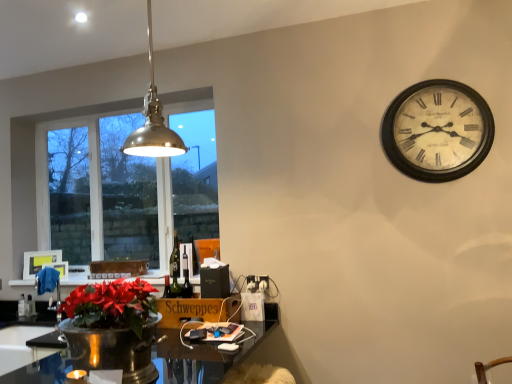
Question: In which direction should I rotate to look at brown cardboard box at lower center, the first cardboard box viewed from the left?

Choices:
 (A) right
 (B) left

Answer: (B)

Question: Is clear glass window at left thinner than metallic pendant light at upper left?

Choices:
 (A) yes
 (B) no

Answer: (A)

Question: Does clear glass window at left have a greater width compared to metallic pendant light at upper left?

Choices:
 (A) no
 (B) yes

Answer: (A)

Question: From a real-world perspective, is clear glass window at left positioned under metallic pendant light at upper left based on gravity?

Choices:
 (A) no
 (B) yes

Answer: (B)

Question: Are clear glass window at left and metallic pendant light at upper left making contact?

Choices:
 (A) no
 (B) yes

Answer: (A)

Question: Does clear glass window at left have a smaller size compared to metallic pendant light at upper left?

Choices:
 (A) yes
 (B) no

Answer: (B)

Question: From the image's perspective, is clear glass window at left above metallic pendant light at upper left?

Choices:
 (A) yes
 (B) no

Answer: (B)

Question: Does white painted wood clock at upper right come in front of shiny black desk at lower center?

Choices:
 (A) no
 (B) yes

Answer: (A)

Question: Can you confirm if white painted wood clock at upper right is positioned to the right of shiny black desk at lower center?

Choices:
 (A) no
 (B) yes

Answer: (B)

Question: Does white painted wood clock at upper right have a greater height compared to shiny black desk at lower center?

Choices:
 (A) no
 (B) yes

Answer: (B)

Question: From a real-world perspective, does white painted wood clock at upper right sit lower than shiny black desk at lower center?

Choices:
 (A) no
 (B) yes

Answer: (A)

Question: Can you confirm if white painted wood clock at upper right is smaller than shiny black desk at lower center?

Choices:
 (A) no
 (B) yes

Answer: (B)

Question: From the image's perspective, does white painted wood clock at upper right appear higher than shiny black desk at lower center?

Choices:
 (A) no
 (B) yes

Answer: (B)

Question: Is white plastic power outlet at lower center far from wooden schweppes at lower center, the 2th cardboard box from the top?

Choices:
 (A) yes
 (B) no

Answer: (B)